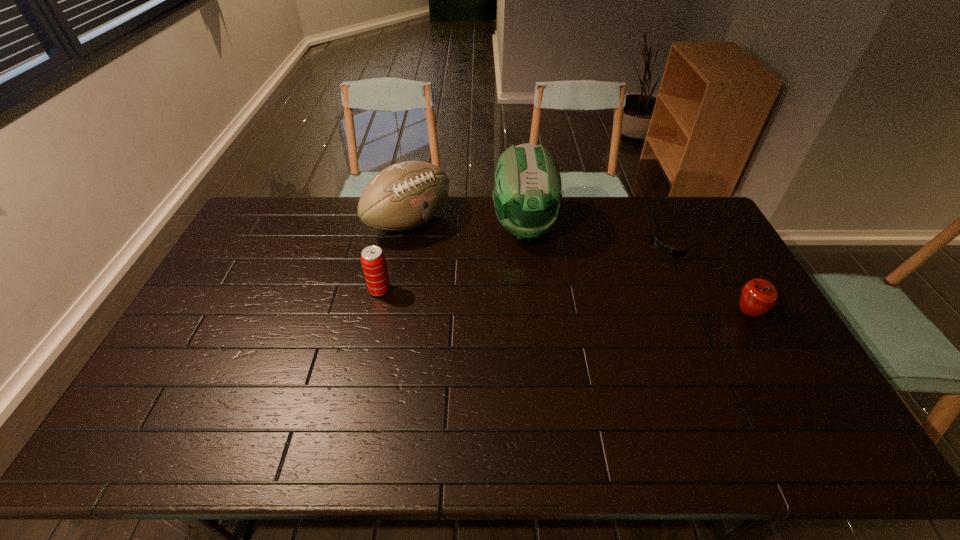
At what (x,y) coordinates should I click in order to perform the action: click on the fourth farthest object. Please return your answer as a coordinate pair (x, y). Looking at the image, I should click on (373, 261).

Find the location of a particular element. This screenshot has height=540, width=960. the third shortest object is located at coordinates (373, 261).

Locate an element on the screen. the second shortest object is located at coordinates (758, 296).

The height and width of the screenshot is (540, 960). In order to click on the nearest object in this screenshot , I will do `click(758, 296)`.

You are a GUI agent. You are given a task and a screenshot of the screen. Output one action in this format:
    pyautogui.click(x=<x>, y=<y>)
    Task: Click on the football helmet
    The image size is (960, 540).
    Given the screenshot: What is the action you would take?
    pyautogui.click(x=528, y=192)

What are the coordinates of `the tallest object` in the screenshot? It's located at (528, 192).

Where is `sunglasses`? This screenshot has height=540, width=960. sunglasses is located at coordinates (671, 252).

The height and width of the screenshot is (540, 960). What are the coordinates of `football (American)` in the screenshot? It's located at (403, 196).

Identify the location of vacant space located on the left of the fourth farthest object. The width and height of the screenshot is (960, 540). (279, 290).

Find the location of a particular element. This screenshot has width=960, height=540. vacant area located on the back of the apple is located at coordinates (727, 275).